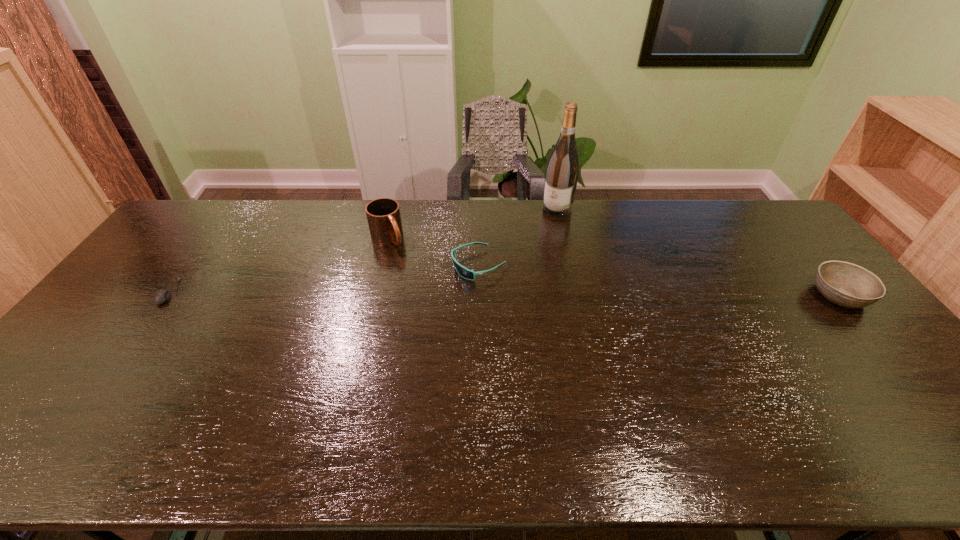
Locate an element on the screen. Image resolution: width=960 pixels, height=540 pixels. the shortest object is located at coordinates (160, 297).

At what (x,y) coordinates should I click in order to perform the action: click on the leftmost object. Please return your answer as a coordinate pair (x, y). This screenshot has width=960, height=540. Looking at the image, I should click on (160, 297).

Image resolution: width=960 pixels, height=540 pixels. Identify the location of the third shortest object. (845, 284).

You are a GUI agent. You are given a task and a screenshot of the screen. Output one action in this format:
    pyautogui.click(x=<x>, y=<y>)
    Task: Click on the bowl
    The width and height of the screenshot is (960, 540).
    Given the screenshot: What is the action you would take?
    pyautogui.click(x=845, y=284)

What are the coordinates of `the third object from right to left` in the screenshot? It's located at (468, 274).

Find the location of `sunglasses`. sunglasses is located at coordinates (468, 274).

Locate an element on the screen. The image size is (960, 540). the second tallest object is located at coordinates (383, 214).

This screenshot has height=540, width=960. Find the location of `mug`. mug is located at coordinates (383, 214).

At what (x,y) coordinates should I click in order to perform the action: click on the tallest object. Please return your answer as a coordinate pair (x, y). This screenshot has width=960, height=540. Looking at the image, I should click on (562, 172).

Where is `wine bottle`? Image resolution: width=960 pixels, height=540 pixels. wine bottle is located at coordinates (562, 172).